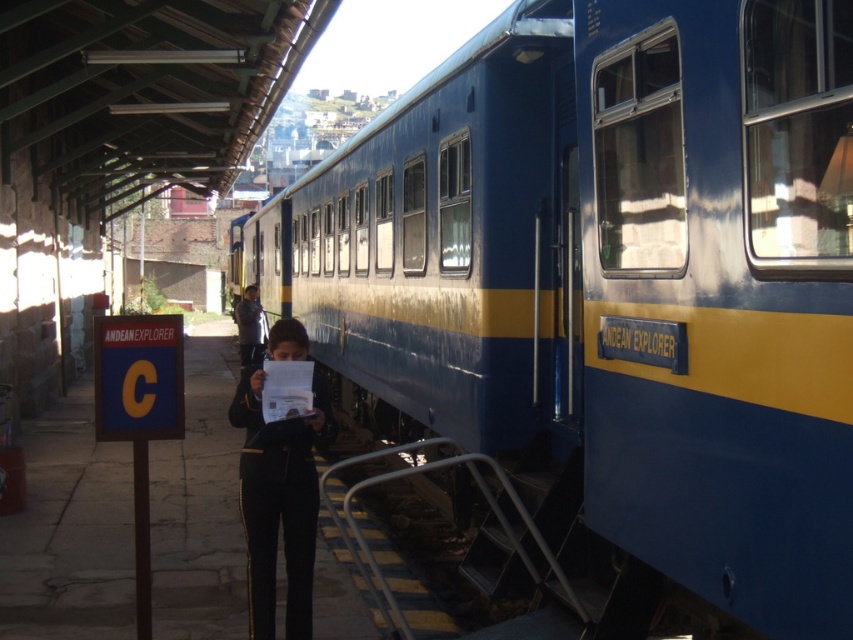
Does black fabric pants at center have a greater width compared to dark blue uniform at center?

No, black fabric pants at center is not wider than dark blue uniform at center.

Does black fabric pants at center appear on the right side of dark blue uniform at center?

Correct, you'll find black fabric pants at center to the right of dark blue uniform at center.

Find the location of a particular element. black fabric pants at center is located at coordinates (279, 502).

Can you confirm if blue polished metal train at center is taller than dark blue uniform at center?

Yes, blue polished metal train at center is taller than dark blue uniform at center.

Does point (271, 228) come farther from viewer compared to point (248, 316)?

Yes, point (271, 228) is behind point (248, 316).

Does point (782, 547) come in front of point (234, 317)?

Yes, it is.

Identify the location of blue polished metal train at center. (612, 292).

Does point (460, 285) come in front of point (300, 442)?

No, it is behind (300, 442).

Consider the image. Does blue polished metal train at center come behind black fabric pants at center?

No, it is not.

Image resolution: width=853 pixels, height=640 pixels. I want to click on blue polished metal train at center, so click(612, 292).